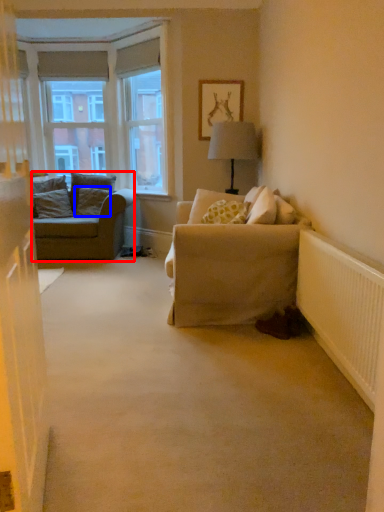
Question: Which object appears closest to the camera in this image, studio couch (highlighted by a red box) or pillow (highlighted by a blue box)?

Choices:
 (A) studio couch
 (B) pillow

Answer: (A)